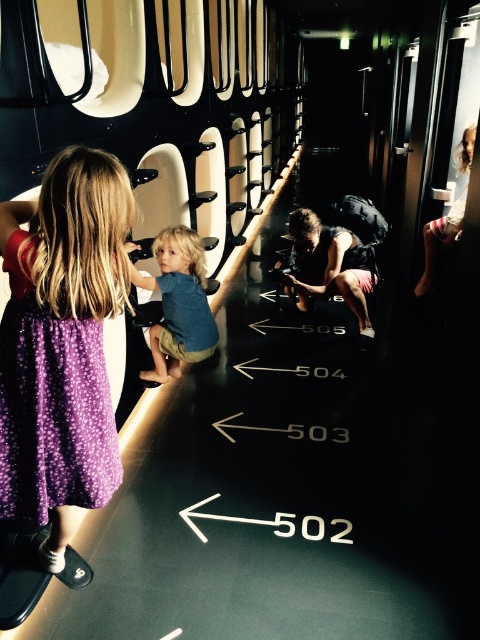
Question: Which of the following is the farthest from the observer?

Choices:
 (A) (31, 452)
 (B) (177, 356)

Answer: (B)

Question: Does purple dotted dress at left come in front of blue cotton shirt at center?

Choices:
 (A) yes
 (B) no

Answer: (A)

Question: Is purple dotted dress at left smaller than blue cotton shirt at center?

Choices:
 (A) no
 (B) yes

Answer: (B)

Question: Which object is farther from the camera taking this photo?

Choices:
 (A) blue cotton shirt at center
 (B) purple dotted dress at left

Answer: (A)

Question: Is purple dotted dress at left positioned at the back of blue cotton shirt at center?

Choices:
 (A) yes
 (B) no

Answer: (B)